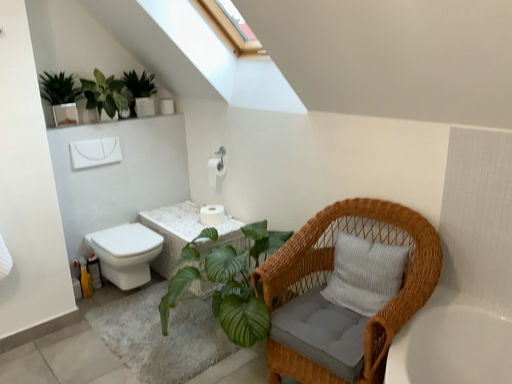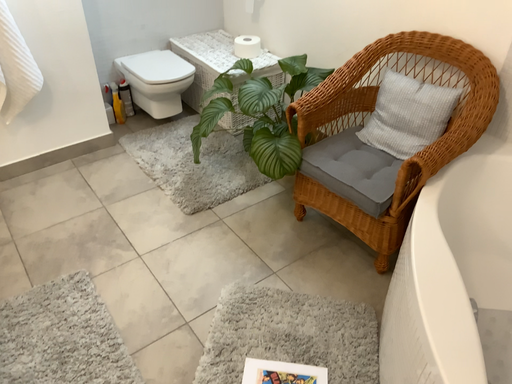
Question: How did the camera likely rotate when shooting the video?

Choices:
 (A) rotated upward
 (B) rotated downward

Answer: (B)